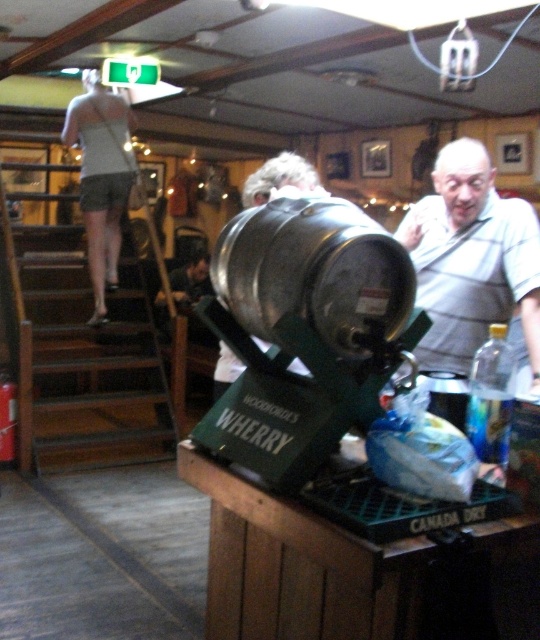
You are a customer in the pub and want to choose between the gray striped shirt at upper right and the light gray fabric shorts at upper left as a souvenir. Which one is smaller in size?

The gray striped shirt at upper right has a smaller size compared to the light gray fabric shorts at upper left.

You are a customer at the pub and want to grab the shiny silver barrel at center and light gray fabric shorts at upper left. Which object is easier to reach without moving your current position?

The shiny silver barrel at center is closer to the viewer than the light gray fabric shorts at upper left, so it is easier to reach without moving.

You are standing in the pub and want to place a new drink order on the table. The table is located at position point 0.423, 0.580. Is the shiny silver barrel at center currently occupying that position?

Yes, the shiny silver barrel at center is located at point (313, 269), so it is occupying the table position where you want to place the new drink order.